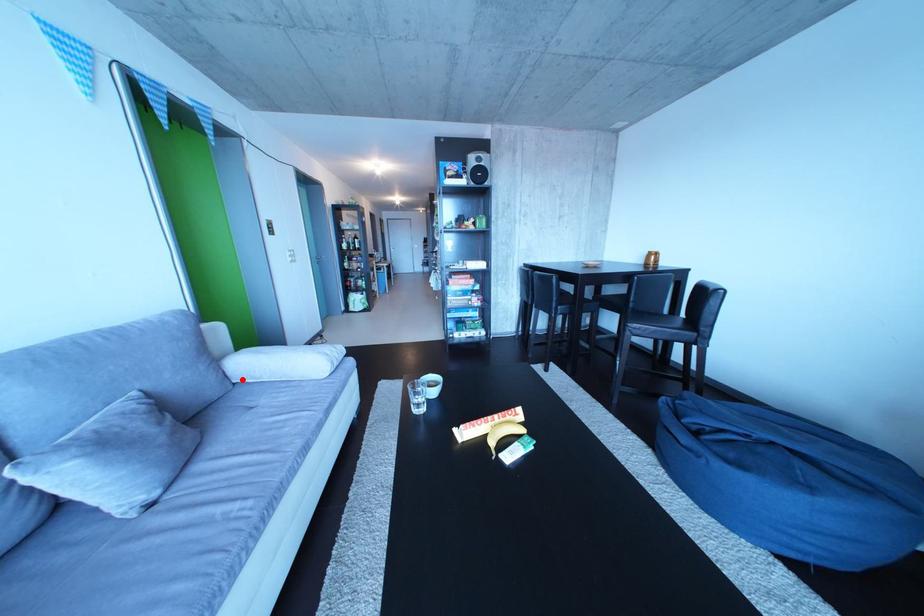
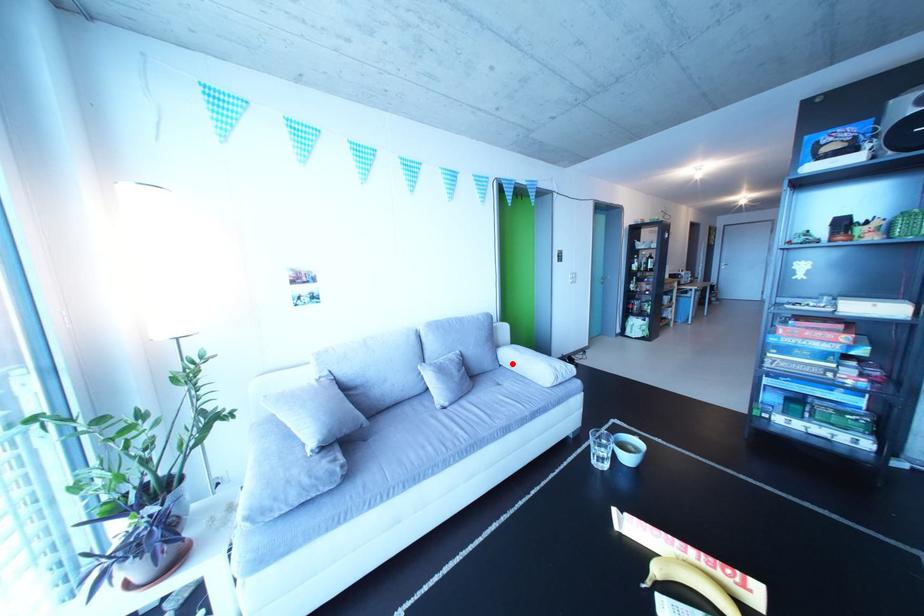
I am providing you with two images of the same scene from different viewpoints. A red point is marked on the first image and another point is marked on the second image. Do the highlighted points in image1 and image2 indicate the same real-world spot?

Yes